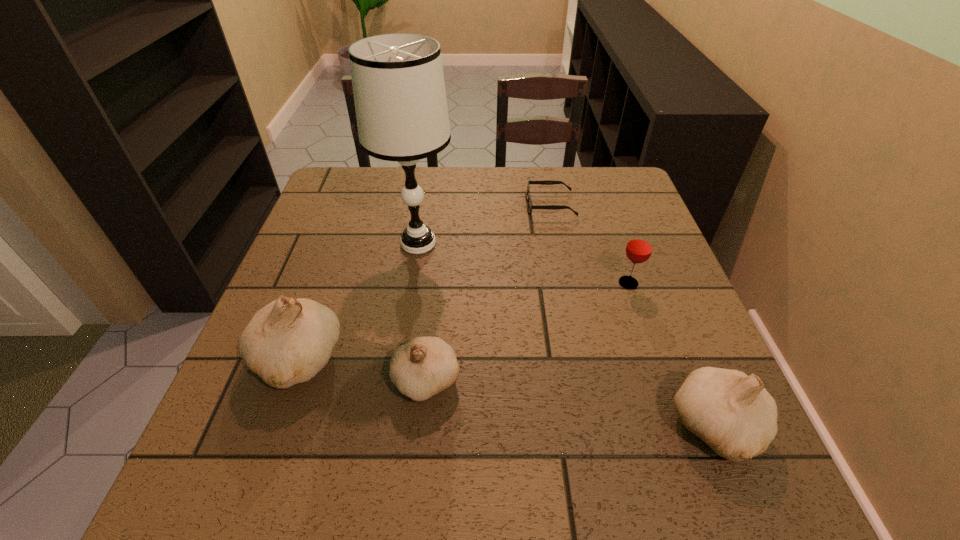
You are a GUI agent. You are given a task and a screenshot of the screen. Output one action in this format:
    pyautogui.click(x=<x>, y=<y>)
    Task: Click on the garlic object that ranks as the second closest to the fifth tallest object
    Image resolution: width=960 pixels, height=540 pixels.
    Given the screenshot: What is the action you would take?
    pyautogui.click(x=733, y=413)

Where is `garlic that is the closest to the leftmost object`? garlic that is the closest to the leftmost object is located at coordinates (424, 366).

Find the location of a particular element. vacant space that satisfies the following two spatial constraints: 1. on the back side of the table lamp; 2. on the right side of the leftmost garlic is located at coordinates (340, 244).

In order to click on free space in the image that satisfies the following two spatial constraints: 1. on the front side of the fifth tallest object; 2. on the left side of the table lamp in this screenshot , I will do `click(396, 381)`.

In order to click on vacant point that satisfies the following two spatial constraints: 1. at the front lenses of the second tallest garlic; 2. on the left side of the sunglasses in this screenshot , I will do `click(595, 427)`.

The image size is (960, 540). In order to click on free space that satisfies the following two spatial constraints: 1. on the back side of the leftmost object; 2. on the left side of the glass in this screenshot , I will do `click(325, 283)`.

Identify the location of free space that satisfies the following two spatial constraints: 1. at the front lenses of the fourth object from left to right; 2. on the left side of the rightmost garlic. [595, 427].